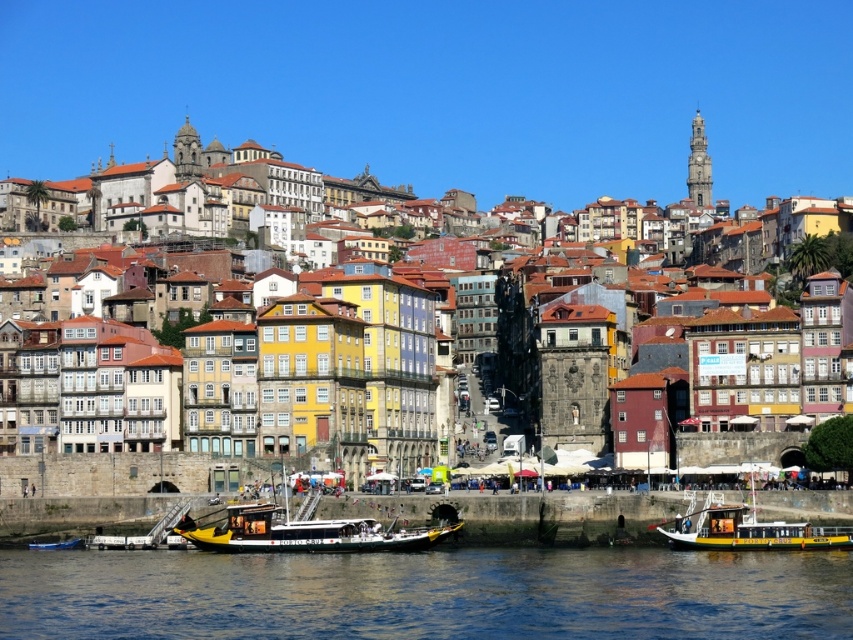
Is point (0, 609) positioned behind point (752, 522)?

That is False.

Is point (0, 576) in front of point (711, 536)?

Yes, it is.

This screenshot has width=853, height=640. What are the coordinates of `blue water at lower center` in the screenshot? It's located at (426, 593).

Can you confirm if blue water at lower center is positioned below yellow-green wooden boat at lower center?

Yes.

Is point (700, 602) farther from viewer compared to point (200, 547)?

No.

Is point (805, 636) in front of point (219, 531)?

Yes, it is.

The height and width of the screenshot is (640, 853). Identify the location of blue water at lower center. (426, 593).

Looking at this image, is blue water at lower center positioned in front of blue painted wooden boat at lower left?

Yes, it is in front of blue painted wooden boat at lower left.

Consider the image. Is blue water at lower center positioned at the back of blue painted wooden boat at lower left?

No, blue water at lower center is in front of blue painted wooden boat at lower left.

Between point (106, 632) and point (56, 541), which one is positioned in front?

Point (106, 632) is in front.

Locate an element on the screen. The width and height of the screenshot is (853, 640). blue water at lower center is located at coordinates (426, 593).